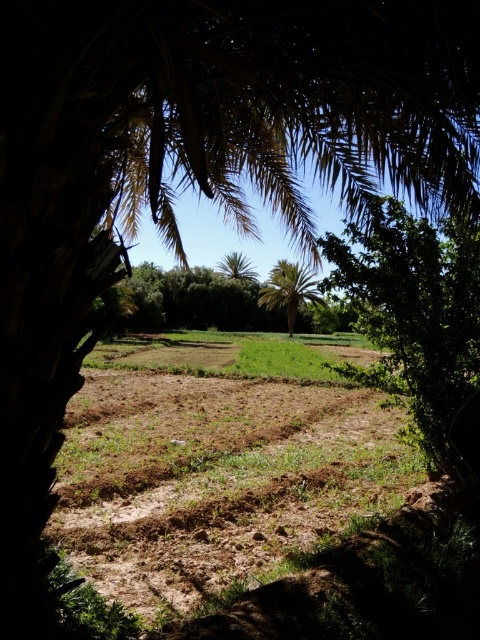
You are standing in front of a palm tree and looking through its fronds. There is a point marked at coordinates (214, 472). Which object in the scene is located at this point?

The point at (214, 472) marks the brown soil at center.

You are a farmer who wants to plant a new crop row starting from the brown soil at center and extending towards the green leafy palm tree at center. How far apart are these two points?

The distance between the brown soil at center and the green leafy palm tree at center is 57.20 meters, so the crop row would need to span this distance.